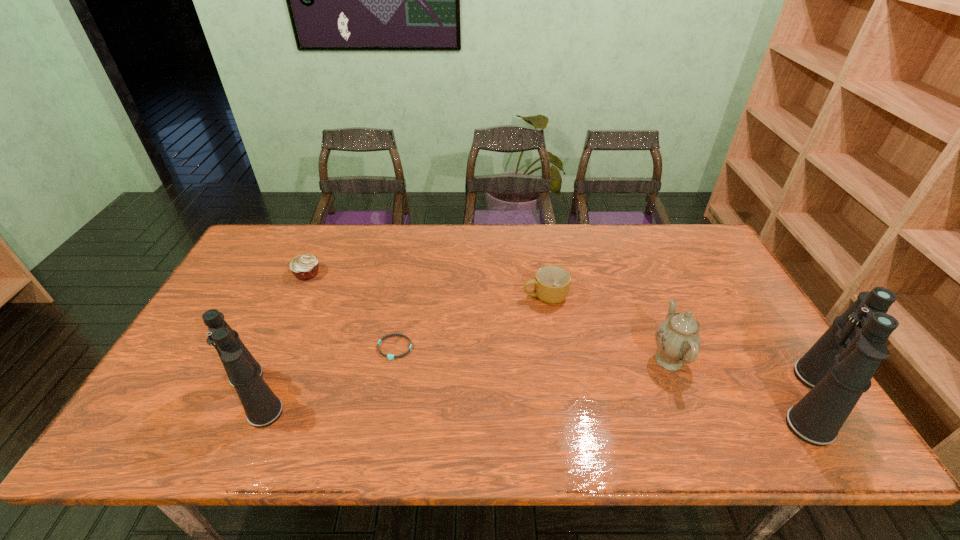
Please point a location where one more binoculars can be added evenly. Please provide its 2D coordinates. Your answer should be formatted as a tuple, i.e. [(x, y)], where the tuple contains the x and y coordinates of a point satisfying the conditions above.

[(532, 397)]